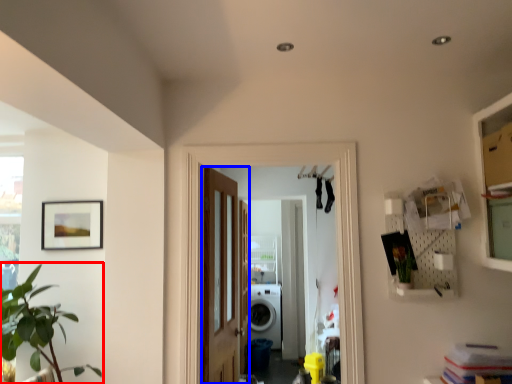
Question: Which object appears farthest to the camera in this image, houseplant (highlighted by a red box) or door (highlighted by a blue box)?

Choices:
 (A) houseplant
 (B) door

Answer: (B)